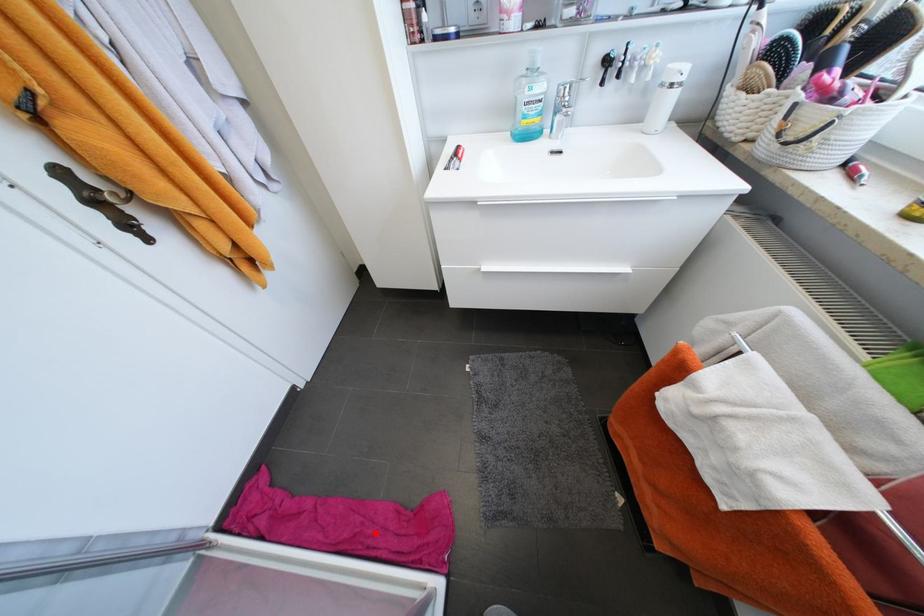
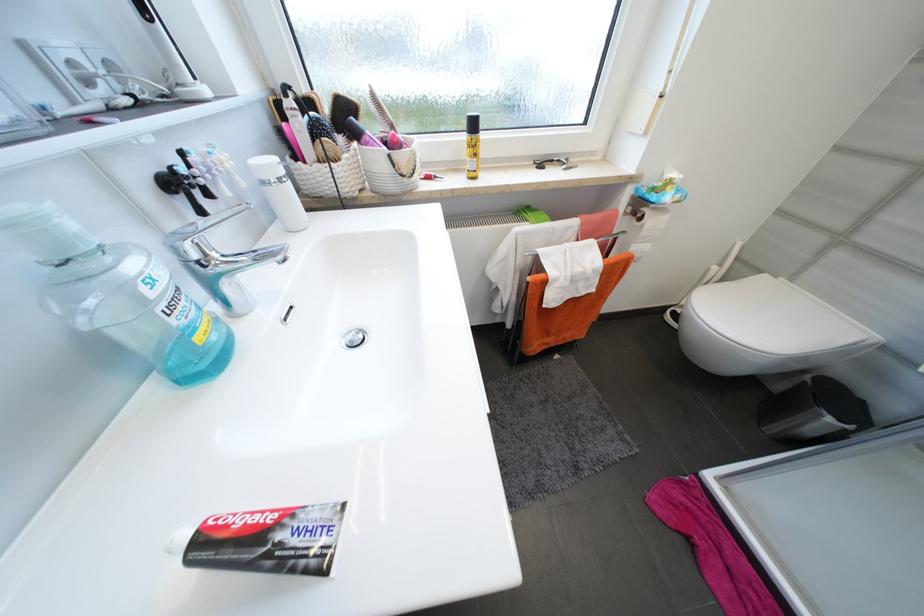
In the second image, find the point that corresponds to the highlighted location in the first image.

(759, 596)